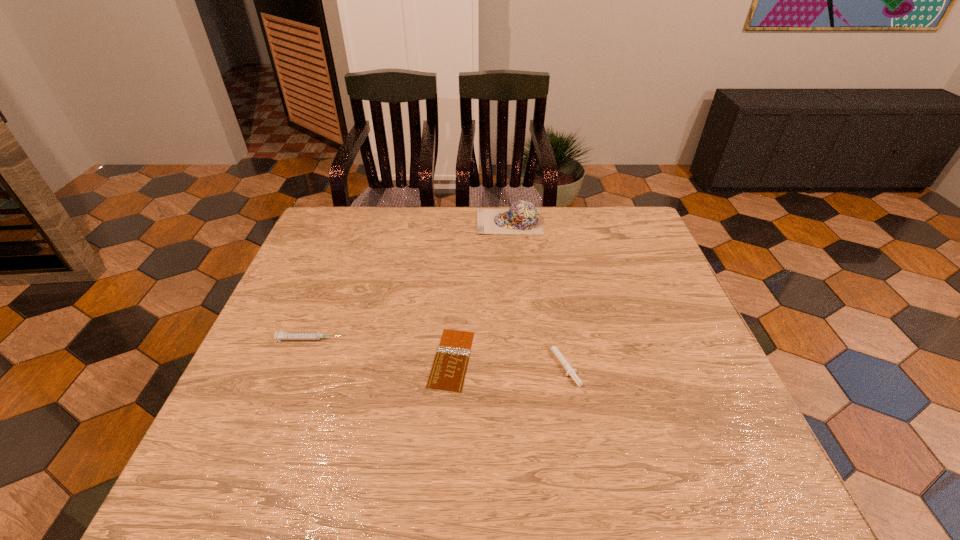
Image resolution: width=960 pixels, height=540 pixels. In order to click on cap in this screenshot , I will do `click(523, 217)`.

This screenshot has height=540, width=960. I want to click on the farthest object, so click(x=523, y=217).

Find the location of a particular element. The image size is (960, 540). the leftmost object is located at coordinates (281, 335).

Identify the location of the third shortest object. (281, 335).

This screenshot has height=540, width=960. I want to click on the shorter syringe, so click(570, 371).

Where is `the third tallest object`? the third tallest object is located at coordinates (570, 371).

You are a GUI agent. You are given a task and a screenshot of the screen. Output one action in this format:
    pyautogui.click(x=<x>, y=<y>)
    Task: Click on the second object from left to right
    This screenshot has height=540, width=960.
    Given the screenshot: What is the action you would take?
    pyautogui.click(x=448, y=371)

Find the location of `chocolate bar`. chocolate bar is located at coordinates (448, 371).

This screenshot has width=960, height=540. Identify the location of blank space located on the front, side, and top of the farthest object. point(455,222).

The width and height of the screenshot is (960, 540). Find the location of `vacant area located 0.390m on the front, side, and top of the farthest object`. vacant area located 0.390m on the front, side, and top of the farthest object is located at coordinates (358, 222).